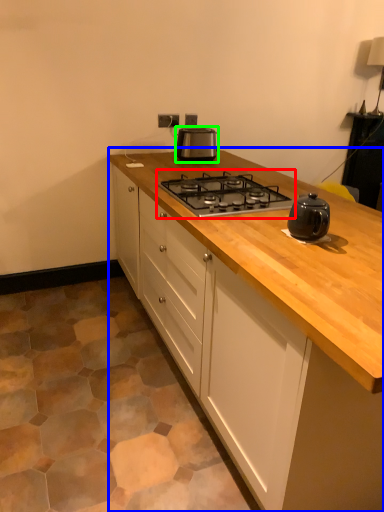
Question: Estimate the real-world distances between objects in this image. Which object is farther from gas stove (highlighted by a red box), cabinetry (highlighted by a blue box) or kitchen appliance (highlighted by a green box)?

Choices:
 (A) cabinetry
 (B) kitchen appliance

Answer: (B)